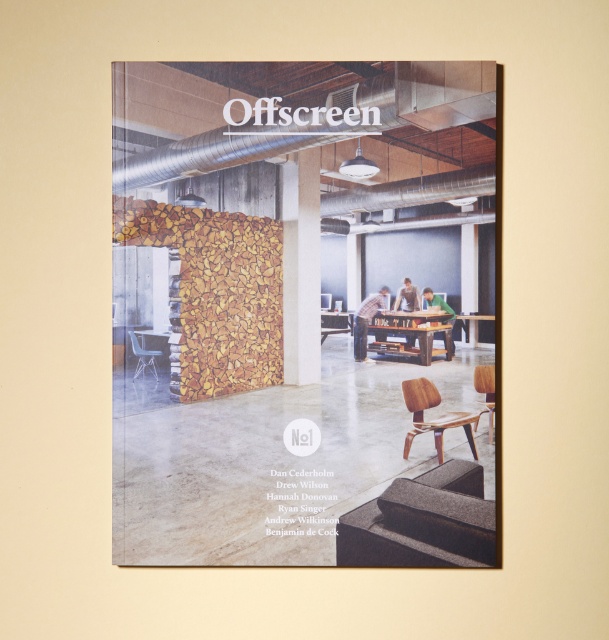
Where is the wooden chair at lower right located in the image?

The wooden chair at lower right is located at point (434, 419).

You are standing in the office shown in the image. You want to hang a new poster on the wall behind the wooden chair at right. Is the matte wood poster at center currently blocking that area?

The matte wood poster at center is in front of the wooden chair at right, meaning it is blocking the area behind the wooden chair at right. You would need to move the matte wood poster at center to access the wall behind the wooden chair at right.

You are a delivery person who needs to place a package between the matte wood poster at center and the wooden chair at right. The package is 20 inches long. Can you fit it in the space between them?

The distance between the matte wood poster at center and the wooden chair at right is 19.24 inches, which is shorter than the package length of 20 inches. Therefore, the package cannot fit in the space between them.